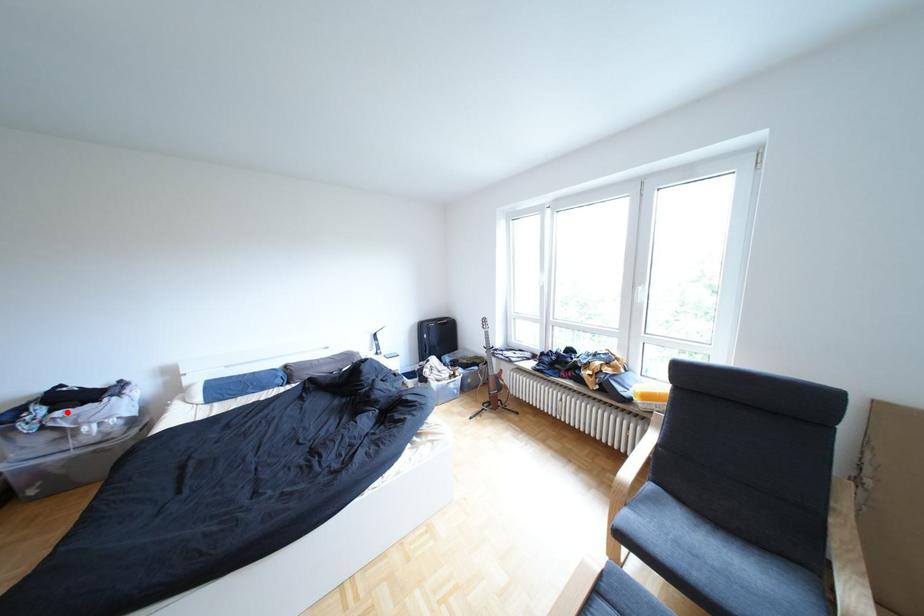
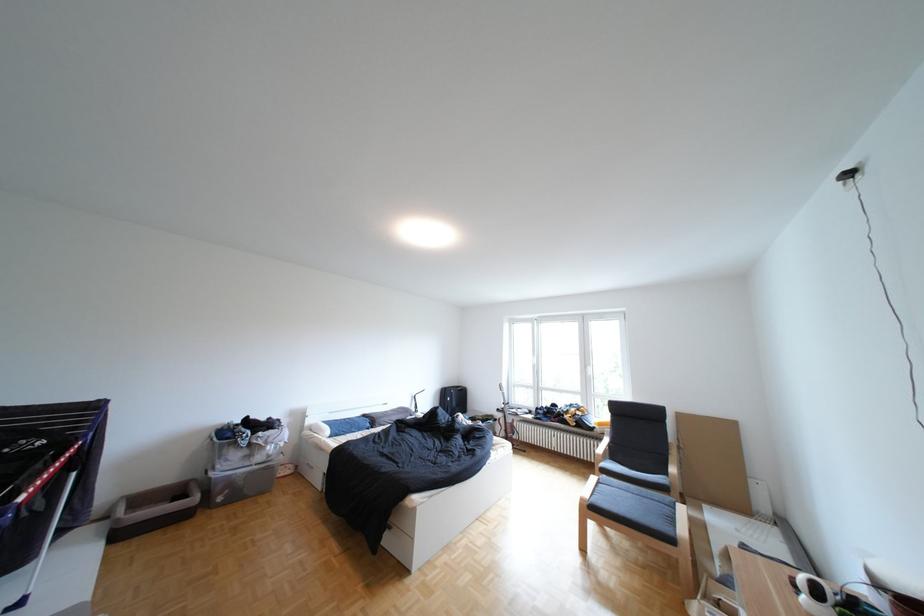
Question: A red point is marked in image1. In image2, is the corresponding 3D point closer to the camera or farther? Reply with the corresponding letter.

Choices:
 (A) The corresponding 3D point is closer.
 (B) The corresponding 3D point is farther.

Answer: (B)